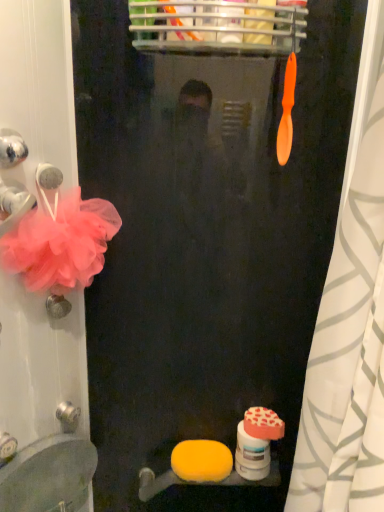
The width and height of the screenshot is (384, 512). What do you see at coordinates (251, 455) in the screenshot?
I see `white matte toilet paper at lower center` at bounding box center [251, 455].

This screenshot has width=384, height=512. What do you see at coordinates (49, 475) in the screenshot?
I see `matte white sink at lower left` at bounding box center [49, 475].

At what (x,y) coordinates should I click in order to perform the action: click on matte white sink at lower left. Please return your answer as a coordinate pair (x, y). Image resolution: width=384 pixels, height=512 pixels. Looking at the image, I should click on (49, 475).

The image size is (384, 512). What do you see at coordinates (61, 244) in the screenshot?
I see `pink tulle flower at left` at bounding box center [61, 244].

Where is `white matte toilet paper at lower center`? The height and width of the screenshot is (512, 384). white matte toilet paper at lower center is located at coordinates (251, 455).

Is white matte toilet paper at lower center surrounding yellow sponge at lower center, which is the first soap from left to right?

No, yellow sponge at lower center, which is the first soap from left to right, is not surrounded by white matte toilet paper at lower center.

How different are the orientations of white matte toilet paper at lower center and yellow sponge at lower center, which is the first soap in bottom-to-top order, in degrees?

They differ by 0.00187 degrees in their facing directions.

Does white matte toilet paper at lower center appear on the left side of yellow sponge at lower center, arranged as the second soap when viewed from the top?

No, white matte toilet paper at lower center is not to the left of yellow sponge at lower center, arranged as the second soap when viewed from the top.

In terms of width, does white matte toilet paper at lower center look wider or thinner when compared to yellow sponge at lower center, arranged as the second soap when viewed from the top?

In the image, white matte toilet paper at lower center appears to be more narrow than yellow sponge at lower center, arranged as the second soap when viewed from the top.

Is yellow sponge at lower center, which is the first soap from left to right, in contact with pink tulle flower at left?

There is a gap between yellow sponge at lower center, which is the first soap from left to right, and pink tulle flower at left.

Looking at this image, is yellow sponge at lower center, which is the first soap in bottom-to-top order, aimed at pink tulle flower at left?

No, yellow sponge at lower center, which is the first soap in bottom-to-top order, does not turn towards pink tulle flower at left.

Is yellow sponge at lower center, arranged as the second soap when viewed from the top, taller than pink tulle flower at left?

Incorrect, the height of yellow sponge at lower center, arranged as the second soap when viewed from the top, is not larger of that of pink tulle flower at left.

Considering the positions of points (198, 444) and (372, 317), is point (198, 444) closer to camera compared to point (372, 317)?

No, it is behind (372, 317).

Considering the relative sizes of yellow sponge at lower center, which is the first soap from left to right, and orange matte shower curtain at right in the image provided, is yellow sponge at lower center, which is the first soap from left to right, shorter than orange matte shower curtain at right?

Correct, yellow sponge at lower center, which is the first soap from left to right, is not as tall as orange matte shower curtain at right.

Which object is more forward, yellow sponge at lower center, arranged as the second soap when viewed from the top, or orange matte shower curtain at right?

orange matte shower curtain at right is closer to the camera.

Can you tell me how much yellow sponge at lower center, arranged as the second soap when viewed from the top, and orange matte shower curtain at right differ in facing direction?

yellow sponge at lower center, arranged as the second soap when viewed from the top, and orange matte shower curtain at right are facing 75.4 degrees away from each other.

Does pink tulle flower at left have a greater height compared to white matte toilet paper at lower center?

Yes.

Is pink tulle flower at left in front of white matte toilet paper at lower center?

Yes, the depth of pink tulle flower at left is less than that of white matte toilet paper at lower center.

From the picture: From a real-world perspective, which object rests below the other?

white matte toilet paper at lower center.

Is point (73, 264) behind point (248, 477)?

That is False.

Does orange matte shower curtain at right turn towards yellow sponge at lower center, which is the first soap from left to right?

No, orange matte shower curtain at right does not turn towards yellow sponge at lower center, which is the first soap from left to right.

Based on the photo, can you tell me how much orange matte shower curtain at right and yellow sponge at lower center, arranged as the second soap when viewed from the top, differ in facing direction?

The angle between the facing direction of orange matte shower curtain at right and the facing direction of yellow sponge at lower center, arranged as the second soap when viewed from the top, is 75.4 degrees.

Considering the relative positions of orange matte shower curtain at right and yellow sponge at lower center, arranged as the second soap when viewed from the top, in the image provided, is orange matte shower curtain at right to the left or to the right of yellow sponge at lower center, arranged as the second soap when viewed from the top,?

In the image, orange matte shower curtain at right appears on the right side of yellow sponge at lower center, arranged as the second soap when viewed from the top.

Considering the sizes of orange matte shower curtain at right and yellow sponge at lower center, arranged as the second soap when viewed from the top, in the image, is orange matte shower curtain at right bigger or smaller than yellow sponge at lower center, arranged as the second soap when viewed from the top,?

In the image, orange matte shower curtain at right appears to be larger than yellow sponge at lower center, arranged as the second soap when viewed from the top.

Between orange matte heart-shaped soap at lower right, positioned as the 2th soap in bottom-to-top order, and white matte toilet paper at lower center, which one has less height?

orange matte heart-shaped soap at lower right, positioned as the 2th soap in bottom-to-top order.

You are a GUI agent. You are given a task and a screenshot of the screen. Output one action in this format:
    pyautogui.click(x=<x>, y=<y>)
    Task: Click on the soap in front of the white matte toilet paper at lower center
    This screenshot has width=384, height=512.
    Given the screenshot: What is the action you would take?
    pyautogui.click(x=263, y=424)

From the image's perspective, between orange matte heart-shaped soap at lower right, positioned as the 2th soap in bottom-to-top order, and white matte toilet paper at lower center, who is located below?

white matte toilet paper at lower center appears lower in the image.

From the image's perspective, is orange plastic toothbrush at upper center on white matte toilet paper at lower center?

Yes, from the image's perspective, orange plastic toothbrush at upper center is above white matte toilet paper at lower center.

Between orange plastic toothbrush at upper center and white matte toilet paper at lower center, which one has larger size?

white matte toilet paper at lower center.

Is orange plastic toothbrush at upper center to the left or to the right of white matte toilet paper at lower center in the image?

Clearly, orange plastic toothbrush at upper center is on the right of white matte toilet paper at lower center in the image.

Which is behind, point (283, 116) or point (251, 439)?

The point (251, 439) is behind.

Locate an element on the screen. soap behind the white matte toilet paper at lower center is located at coordinates (201, 461).

The width and height of the screenshot is (384, 512). I want to click on the 2nd soap positioned below the pink tulle flower at left (from a real-world perspective), so click(201, 461).

Estimate the real-world distances between objects in this image. Which object is further from white matte toilet paper at lower center, orange matte shower curtain at right or yellow sponge at lower center, which is the first soap in bottom-to-top order?

The object further to white matte toilet paper at lower center is orange matte shower curtain at right.

Considering their positions, is matte white sink at lower left positioned closer to pink tulle flower at left than orange matte shower curtain at right?

matte white sink at lower left is closer to pink tulle flower at left.

Considering their positions, is orange matte shower curtain at right positioned closer to white matte toilet paper at lower center than matte white sink at lower left?

matte white sink at lower left lies closer to white matte toilet paper at lower center than the other object.

Considering their positions, is orange plastic toothbrush at upper center positioned closer to orange matte heart-shaped soap at lower right, arranged as the 2th soap when viewed from the left, than matte white sink at lower left?

matte white sink at lower left is positioned closer to the anchor orange matte heart-shaped soap at lower right, arranged as the 2th soap when viewed from the left.

Looking at the image, which one is located closer to orange matte heart-shaped soap at lower right, the 1th soap positioned from the right, orange plastic toothbrush at upper center or white matte toilet paper at lower center?

The object closer to orange matte heart-shaped soap at lower right, the 1th soap positioned from the right, is white matte toilet paper at lower center.

From the image, which object appears to be nearer to white matte toilet paper at lower center, yellow sponge at lower center, arranged as the second soap when viewed from the top, or orange plastic toothbrush at upper center?

yellow sponge at lower center, arranged as the second soap when viewed from the top, is positioned closer to the anchor white matte toilet paper at lower center.

Which object lies nearer to the anchor point pink tulle flower at left, yellow sponge at lower center, which is the first soap from left to right, or matte white sink at lower left?

Among the two, matte white sink at lower left is located nearer to pink tulle flower at left.

Considering their positions, is orange matte shower curtain at right positioned closer to pink tulle flower at left than orange plastic toothbrush at upper center?

orange plastic toothbrush at upper center.

Find the location of a particular element. The height and width of the screenshot is (512, 384). soap between pink tulle flower at left and white matte toilet paper at lower center from top to bottom is located at coordinates (263, 424).

Locate an element on the screen. flower between orange plastic toothbrush at upper center and matte white sink at lower left in the up-down direction is located at coordinates (61, 244).

Locate an element on the screen. toilet paper that lies between orange plastic toothbrush at upper center and matte white sink at lower left from top to bottom is located at coordinates point(251,455).

Locate an element on the screen. The height and width of the screenshot is (512, 384). flower between orange plastic toothbrush at upper center and yellow sponge at lower center, which is the first soap in bottom-to-top order, in the vertical direction is located at coordinates (61, 244).